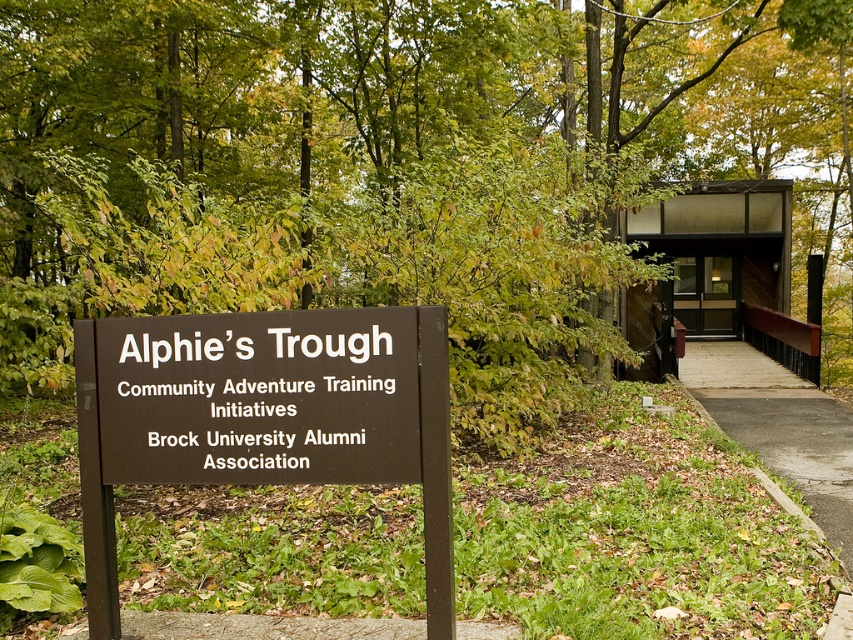
Is green leafy tree at center bigger than brown matte sign at center?

Yes, green leafy tree at center is bigger than brown matte sign at center.

In the scene shown: Is green leafy tree at center to the right of brown matte sign at center from the viewer's perspective?

Correct, you'll find green leafy tree at center to the right of brown matte sign at center.

Where is `green leafy tree at center`? This screenshot has height=640, width=853. green leafy tree at center is located at coordinates (413, 170).

Can you confirm if green leafy tree at center is thinner than asphalt pavement at center?

No, green leafy tree at center is not thinner than asphalt pavement at center.

Measure the distance between green leafy tree at center and camera.

A distance of 6.41 meters exists between green leafy tree at center and camera.

Identify the location of green leafy tree at center. The width and height of the screenshot is (853, 640). (413, 170).

Between brown matte sign at center and asphalt pavement at center, which one has more height?

Standing taller between the two is brown matte sign at center.

The image size is (853, 640). What do you see at coordinates (264, 417) in the screenshot?
I see `brown matte sign at center` at bounding box center [264, 417].

Find the location of a particular element. The image size is (853, 640). brown matte sign at center is located at coordinates (264, 417).